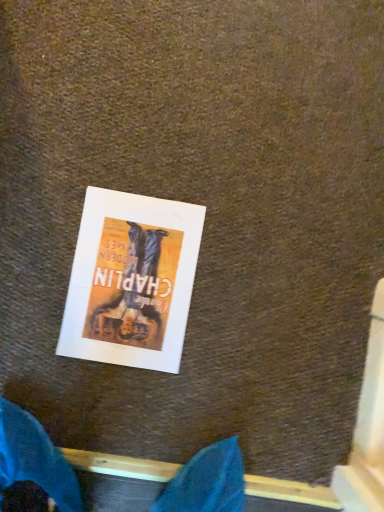
What are the coordinates of `matte paper poster at center` in the screenshot? It's located at (131, 280).

What do you see at coordinates (131, 280) in the screenshot?
I see `matte paper poster at center` at bounding box center [131, 280].

You are a GUI agent. You are given a task and a screenshot of the screen. Output one action in this format:
    pyautogui.click(x=<x>, y=<y>)
    Task: Click on the matte paper poster at center
    
    Given the screenshot: What is the action you would take?
    pyautogui.click(x=131, y=280)